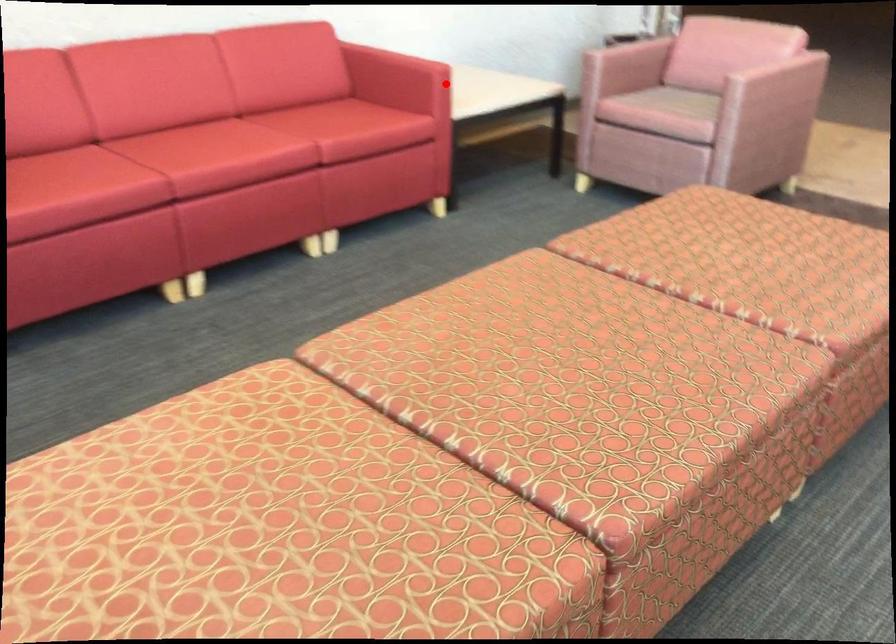
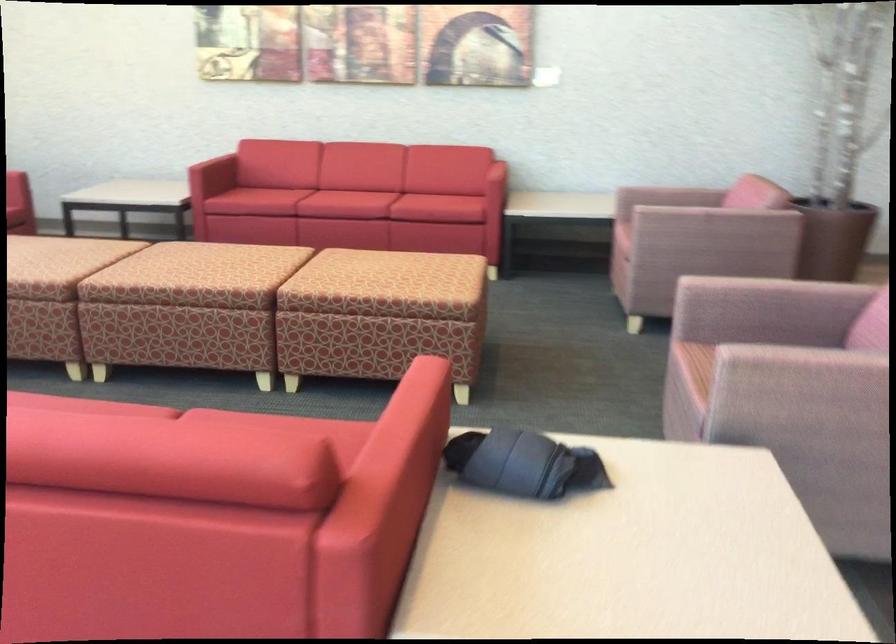
Question: A red point is marked in image1. In image2, is the corresponding 3D point closer to the camera or farther? Reply with the corresponding letter.

Choices:
 (A) The corresponding 3D point is closer.
 (B) The corresponding 3D point is farther.

Answer: (B)